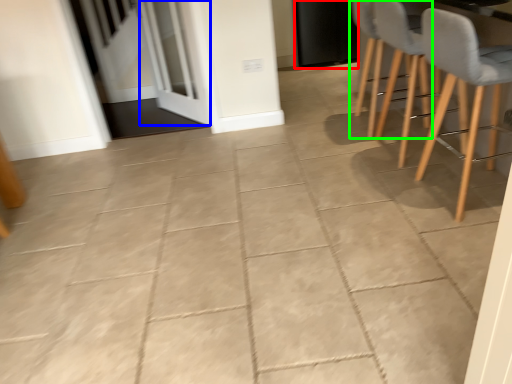
Question: Considering the real-world distances, which object is closest to door (highlighted by a red box)? screen door (highlighted by a blue box) or chair (highlighted by a green box).

Choices:
 (A) screen door
 (B) chair

Answer: (B)